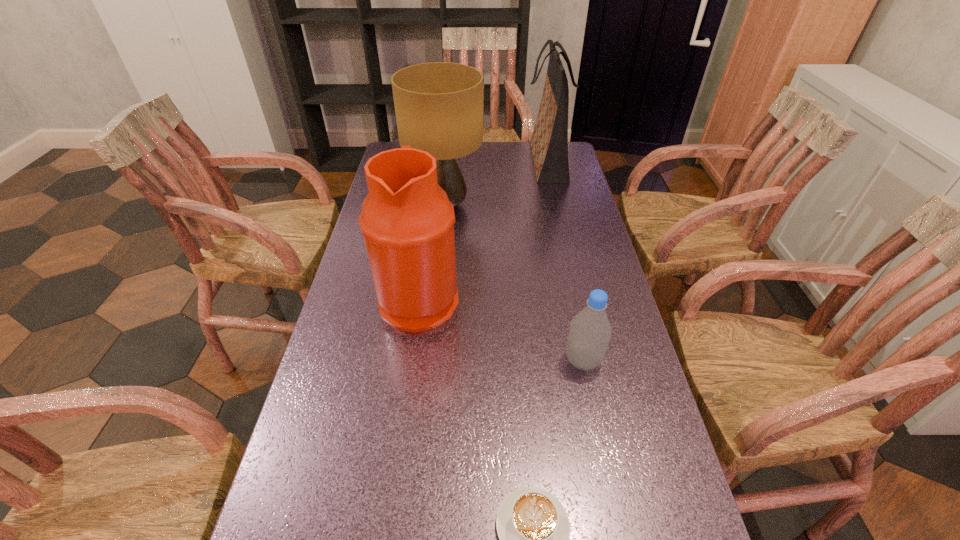
The image size is (960, 540). I want to click on free space between the fourth tallest object and the shopping bag, so click(x=564, y=261).

Identify the location of object identified as the closest to the third nearest object. (439, 105).

Identify which object is the third closest to the water jug. Please provide its 2D coordinates. Your answer should be formatted as a tuple, i.e. [(x, y)], where the tuple contains the x and y coordinates of a point satisfying the conditions above.

[(533, 527)]